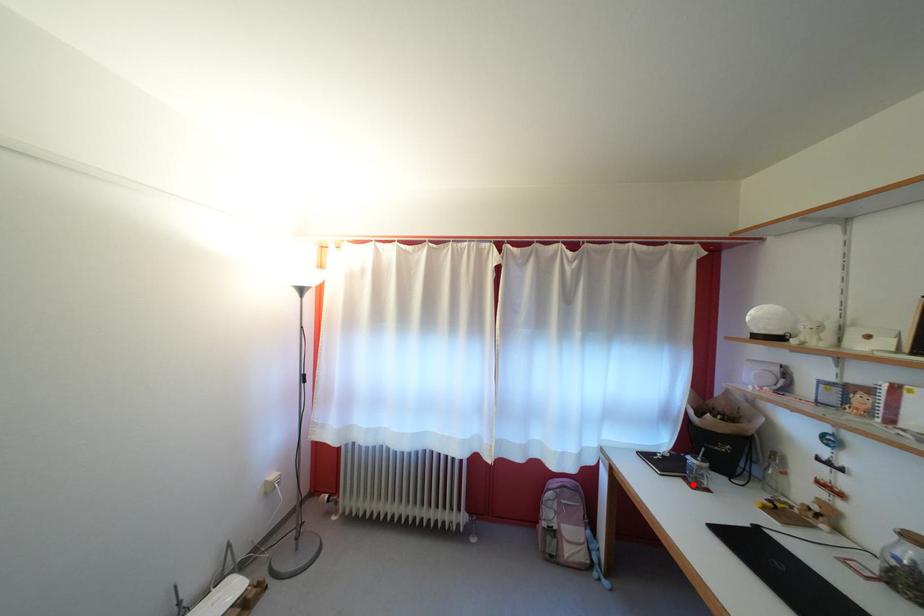
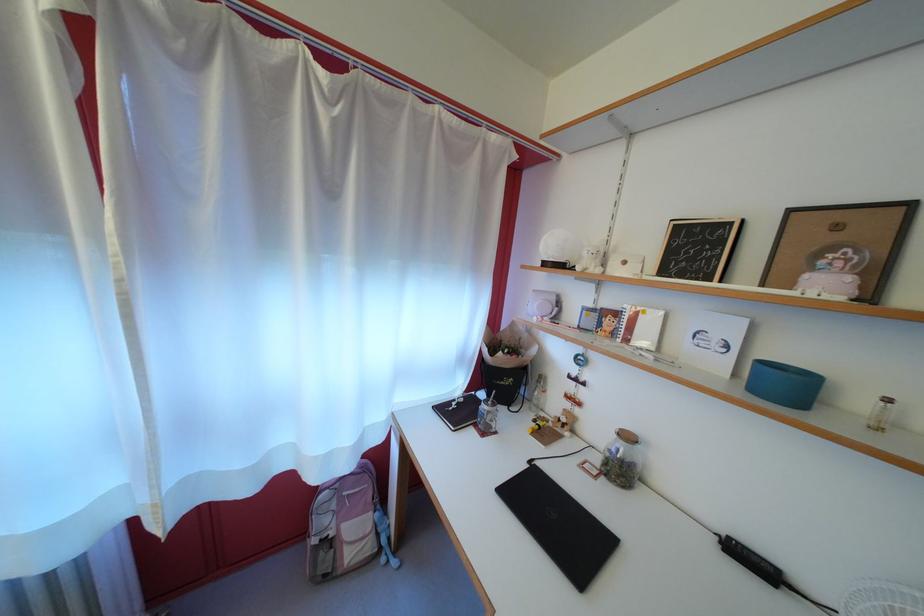
The point at the highlighted location is marked in the first image. Where is the corresponding point in the second image?

(483, 431)